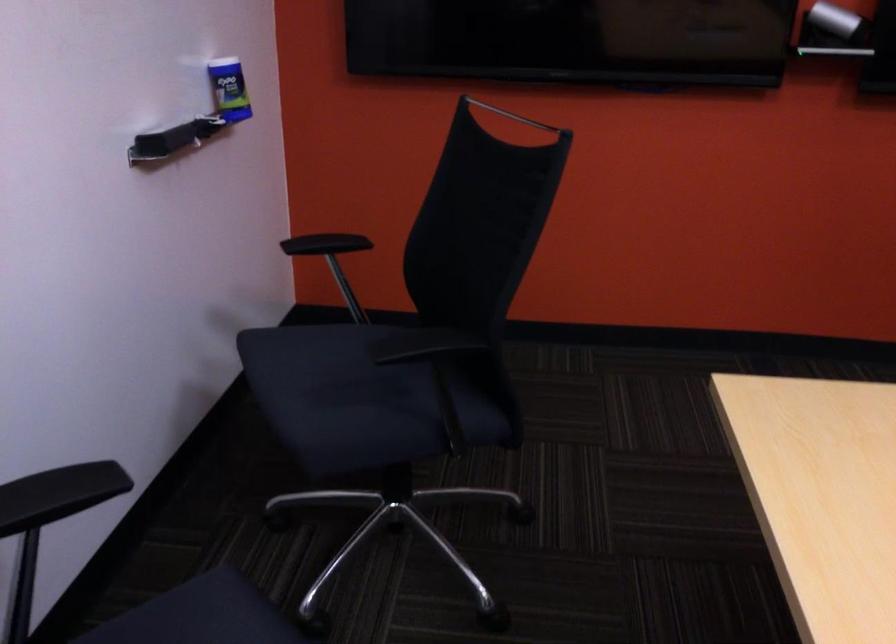
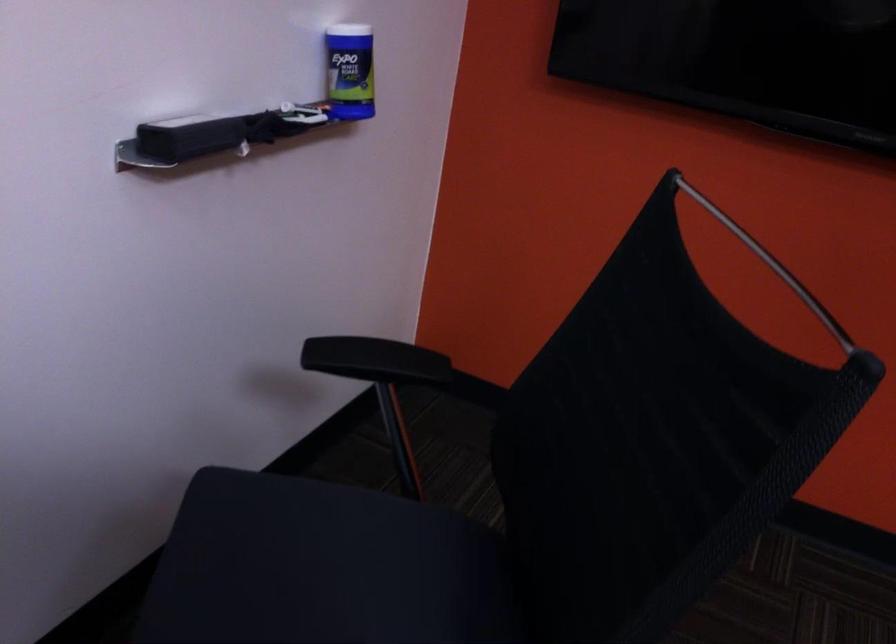
Question: The camera is either moving clockwise (left) or counter-clockwise (right) around the object. The first image is from the beginning of the video and the second image is from the end. Is the camera moving left or right when shooting the video?

Choices:
 (A) Left
 (B) Right

Answer: (B)